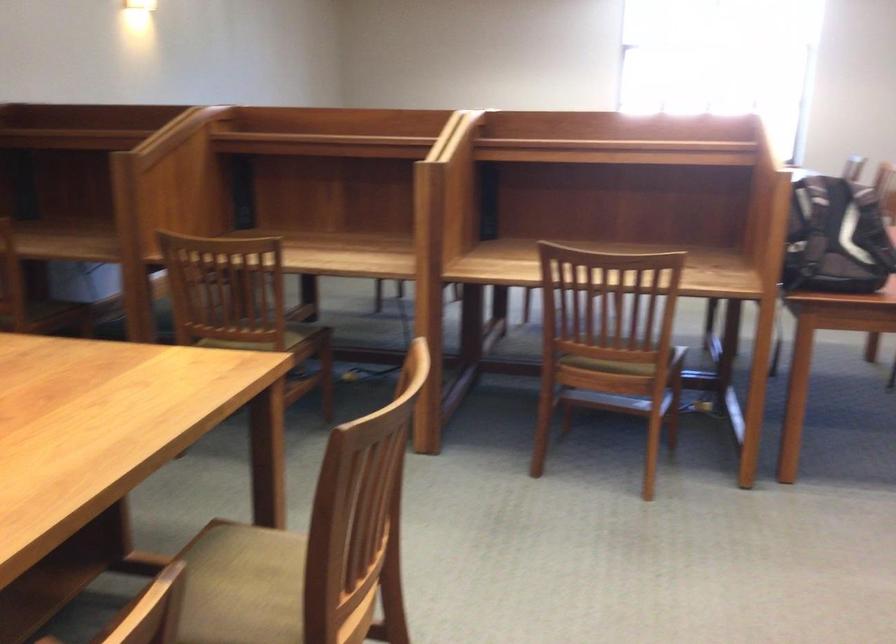
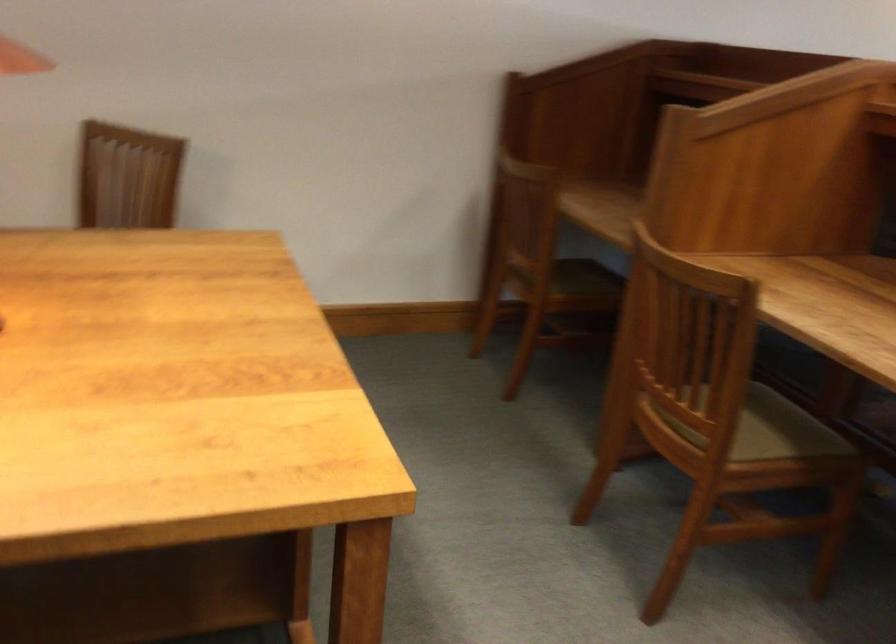
Where in the second image is the point corresponding to point 280,330 from the first image?

(765, 428)